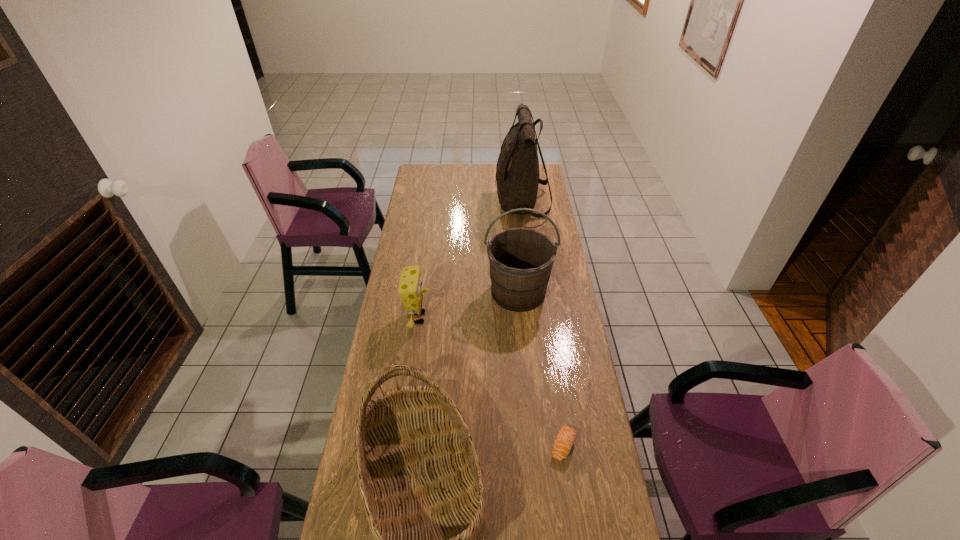
This screenshot has width=960, height=540. Find the location of `empty space between the tallest object and the sushi`. empty space between the tallest object and the sushi is located at coordinates (542, 325).

At what (x,y) coordinates should I click in order to perform the action: click on free spot between the shortest object and the sponge. Please return your answer as a coordinate pair (x, y). Looking at the image, I should click on (491, 382).

Where is `vacant space that's between the sponge and the farthest object`? Image resolution: width=960 pixels, height=540 pixels. vacant space that's between the sponge and the farthest object is located at coordinates (470, 260).

Identify which object is the fourth nearest to the bucket. Please provide its 2D coordinates. Your answer should be formatted as a tuple, i.e. [(x, y)], where the tuple contains the x and y coordinates of a point satisfying the conditions above.

[(566, 436)]

Identify which object is the second closest to the sponge. Please provide its 2D coordinates. Your answer should be formatted as a tuple, i.e. [(x, y)], where the tuple contains the x and y coordinates of a point satisfying the conditions above.

[(420, 478)]

You are a GUI agent. You are given a task and a screenshot of the screen. Output one action in this format:
    pyautogui.click(x=<x>, y=<y>)
    Task: Click on the free space in the image that satisfies the following two spatial constraints: 1. on the open flap of the tallest object; 2. on the back side of the sushi
    The image size is (960, 540).
    Given the screenshot: What is the action you would take?
    pyautogui.click(x=551, y=446)

Find the location of a particular element. The height and width of the screenshot is (540, 960). vacant point that satisfies the following two spatial constraints: 1. on the open flap of the farthest object; 2. on the back side of the sushi is located at coordinates (551, 446).

Find the location of a particular element. vacant space that satisfies the following two spatial constraints: 1. on the open flap of the farthest object; 2. on the left side of the shortest object is located at coordinates (551, 446).

The width and height of the screenshot is (960, 540). In order to click on blank space that satisfies the following two spatial constraints: 1. on the open flap of the shortest object; 2. on the right side of the tallest object in this screenshot , I will do `click(551, 446)`.